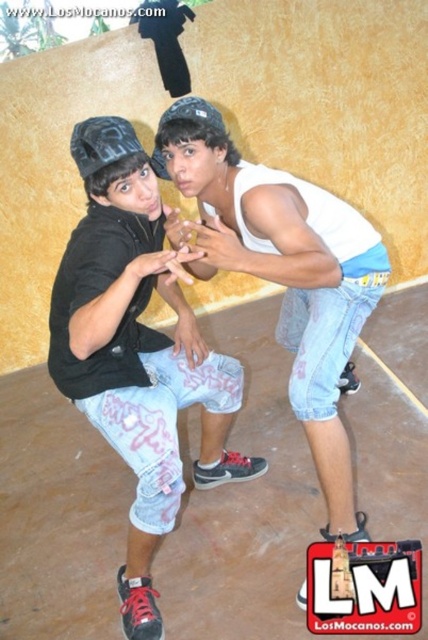
Question: Does denim shorts at center appear under white cotton tank top at upper center?

Choices:
 (A) no
 (B) yes

Answer: (B)

Question: Which of the following is the closest to the observer?

Choices:
 (A) white cotton tank top at upper center
 (B) denim shorts at center

Answer: (B)

Question: Among these objects, which one is nearest to the camera?

Choices:
 (A) denim shorts at center
 (B) white cotton tank top at upper center

Answer: (A)

Question: Observing the image, what is the correct spatial positioning of denim shorts at center in reference to white cotton tank top at upper center?

Choices:
 (A) above
 (B) below

Answer: (B)

Question: Is denim shorts at center thinner than white cotton tank top at upper center?

Choices:
 (A) no
 (B) yes

Answer: (B)